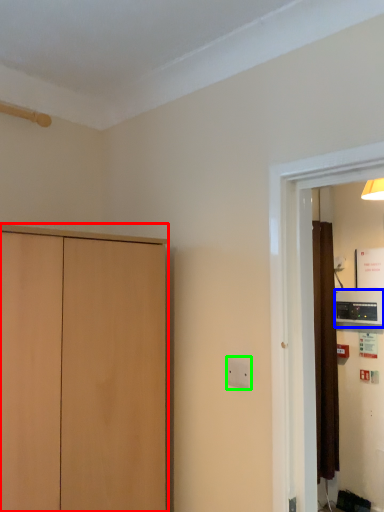
Question: Estimate the real-world distances between objects in this image. Which object is closer to cupboard (highlighted by a red box), appliance (highlighted by a blue box) or electric outlet (highlighted by a green box)?

Choices:
 (A) appliance
 (B) electric outlet

Answer: (B)